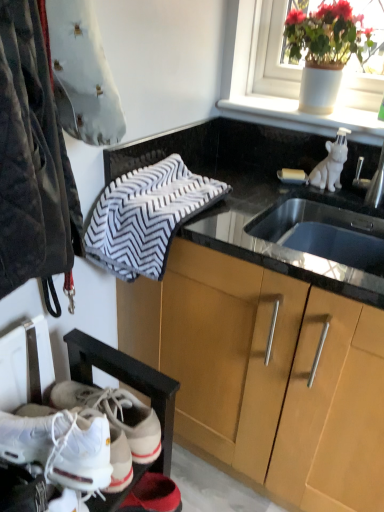
You are a GUI agent. You are given a task and a screenshot of the screen. Output one action in this format:
    pyautogui.click(x=<x>, y=<y>)
    Task: Click on the white glossy ceramic dog at upper right, the 2th animal from the front
    The width and height of the screenshot is (384, 512).
    Given the screenshot: What is the action you would take?
    pyautogui.click(x=331, y=163)

In the scene shown: What is the approximate width of white leather sneakers at lower left?

white leather sneakers at lower left is 30.67 centimeters wide.

Locate an element on the screen. The height and width of the screenshot is (512, 384). wooden cabinet at center is located at coordinates (266, 374).

What do you see at coordinates (266, 374) in the screenshot?
I see `wooden cabinet at center` at bounding box center [266, 374].

Describe the element at coordinates (324, 50) in the screenshot. I see `white ceramic pot at upper right` at that location.

You are a GUI agent. You are given a task and a screenshot of the screen. Output one action in this format:
    pyautogui.click(x=<x>, y=<y>)
    Task: Click on the white glossy ceramic dog at upper right, the 2th animal from the front
    The image size is (384, 512).
    Given the screenshot: What is the action you would take?
    pyautogui.click(x=331, y=163)

Can we say white leather sneakers at lower left lies outside wooden cabinet at center?

Absolutely, white leather sneakers at lower left is external to wooden cabinet at center.

Considering the relative sizes of white leather sneakers at lower left and wooden cabinet at center in the image provided, is white leather sneakers at lower left wider than wooden cabinet at center?

In fact, white leather sneakers at lower left might be narrower than wooden cabinet at center.

Based on their positions, is white leather sneakers at lower left located to the left or right of wooden cabinet at center?

From the image, it's evident that white leather sneakers at lower left is to the left of wooden cabinet at center.

From a real-world perspective, is white leather sneakers at lower left physically located above or below white glossy ceramic dog at upper right, the 2th animal from the front?

Clearly, from a real-world perspective, white leather sneakers at lower left is below white glossy ceramic dog at upper right, the 2th animal from the front.

Is white leather sneakers at lower left thinner than white glossy ceramic dog at upper right, the first animal positioned from the back?

Incorrect, the width of white leather sneakers at lower left is not less than that of white glossy ceramic dog at upper right, the first animal positioned from the back.

Can you tell me how much white leather sneakers at lower left and white glossy ceramic dog at upper right, the 1th animal viewed from the right, differ in facing direction?

92.1 degrees separate the facing orientations of white leather sneakers at lower left and white glossy ceramic dog at upper right, the 1th animal viewed from the right.

In terms of height, does wooden cabinet at center look taller or shorter compared to white glossy ceramic dog at upper right, the 1th animal viewed from the right?

Clearly, wooden cabinet at center is taller compared to white glossy ceramic dog at upper right, the 1th animal viewed from the right.

From the image's perspective, would you say wooden cabinet at center is shown under white glossy ceramic dog at upper right, the 1th animal viewed from the right?

Correct, wooden cabinet at center appears lower than white glossy ceramic dog at upper right, the 1th animal viewed from the right, in the image.

Is wooden cabinet at center positioned in front of white glossy ceramic dog at upper right, the 1th animal viewed from the right?

Yes, wooden cabinet at center is in front of white glossy ceramic dog at upper right, the 1th animal viewed from the right.

Based on their positions, is wooden cabinet at center located to the left or right of white glossy ceramic dog at upper right, the 1th animal viewed from the right?

Clearly, wooden cabinet at center is on the left of white glossy ceramic dog at upper right, the 1th animal viewed from the right, in the image.

From the image's perspective, is velvet-like gray pillow at upper left, which is counted as the second animal, starting from the right, located beneath white leather sneakers at lower left?

Incorrect, from the image's perspective, velvet-like gray pillow at upper left, which is counted as the second animal, starting from the right, is higher than white leather sneakers at lower left.

Which of these two, velvet-like gray pillow at upper left, arranged as the 2th animal when viewed from the back, or white leather sneakers at lower left, is wider?

Wider between the two is white leather sneakers at lower left.

From a real-world perspective, which object stands above the other?

velvet-like gray pillow at upper left, which is counted as the second animal, starting from the right, from a real-world perspective.

Is velvet-like gray pillow at upper left, the first animal in the front-to-back sequence, facing towards white leather sneakers at lower left?

No, velvet-like gray pillow at upper left, the first animal in the front-to-back sequence, is not turned towards white leather sneakers at lower left.

How different are the orientations of wooden cabinet at center and velvet-like gray pillow at upper left, the 1th animal viewed from the left, in degrees?

91.5 degrees.

Considering the relative sizes of wooden cabinet at center and velvet-like gray pillow at upper left, the first animal in the front-to-back sequence, in the image provided, is wooden cabinet at center wider than velvet-like gray pillow at upper left, the first animal in the front-to-back sequence,?

Yes.

Considering the sizes of objects wooden cabinet at center and velvet-like gray pillow at upper left, arranged as the 2th animal when viewed from the back, in the image provided, who is smaller, wooden cabinet at center or velvet-like gray pillow at upper left, arranged as the 2th animal when viewed from the back,?

velvet-like gray pillow at upper left, arranged as the 2th animal when viewed from the back, is smaller.

Is wooden cabinet at center looking in the opposite direction of velvet-like gray pillow at upper left, the first animal in the front-to-back sequence?

wooden cabinet at center does not have its back to velvet-like gray pillow at upper left, the first animal in the front-to-back sequence.

Is point (285, 419) more distant than point (312, 89)?

No, (285, 419) is in front of (312, 89).

Is wooden cabinet at center to the left or to the right of white ceramic pot at upper right in the image?

→ Clearly, wooden cabinet at center is on the left of white ceramic pot at upper right in the image.

Does wooden cabinet at center have a smaller size compared to white ceramic pot at upper right?

Actually, wooden cabinet at center might be larger than white ceramic pot at upper right.

Can we say wooden cabinet at center lies outside white ceramic pot at upper right?

Yes, wooden cabinet at center is outside of white ceramic pot at upper right.

Is white leather sneakers at lower left facing towards gray textured towel at upper center?

No, white leather sneakers at lower left does not turn towards gray textured towel at upper center.

Which is nearer, (68, 428) or (163, 219)?

The point (68, 428) is more forward.

Considering the positions of objects white leather sneakers at lower left and gray textured towel at upper center in the image provided, who is more to the right, white leather sneakers at lower left or gray textured towel at upper center?

gray textured towel at upper center is more to the right.

Considering the relative sizes of white leather sneakers at lower left and gray textured towel at upper center in the image provided, is white leather sneakers at lower left smaller than gray textured towel at upper center?

Yes, white leather sneakers at lower left is smaller than gray textured towel at upper center.

You are a GUI agent. You are given a task and a screenshot of the screen. Output one action in this format:
    pyautogui.click(x=<x>, y=<y>)
    Task: Click on the footwear that appears below the wooden cabinet at center (from the image's perspective)
    Image resolution: width=384 pixels, height=512 pixels.
    Given the screenshot: What is the action you would take?
    pyautogui.click(x=60, y=448)

At what (x,y) coordinates should I click in order to perform the action: click on footwear located underneath the white glossy ceramic dog at upper right, the 2th animal from the front (from a real-world perspective). Please return your answer as a coordinate pair (x, y). Looking at the image, I should click on (60, 448).

Looking at the image, which one is located closer to gray textured towel at upper center, white leather sneakers at lower left or white glossy ceramic dog at upper right, which is counted as the 2th animal, starting from the left?

white leather sneakers at lower left.

Considering their positions, is gray textured towel at upper center positioned further to white ceramic pot at upper right than white glossy ceramic dog at upper right, which is counted as the 2th animal, starting from the left?

gray textured towel at upper center lies further to white ceramic pot at upper right than the other object.

Which object lies nearer to the anchor point wooden cabinet at center, white leather sneakers at lower left or white glossy ceramic dog at upper right, the first animal positioned from the back?

white leather sneakers at lower left lies closer to wooden cabinet at center than the other object.

Looking at the image, which one is located closer to velvet-like gray pillow at upper left, the first animal in the front-to-back sequence, gray textured towel at upper center or white ceramic pot at upper right?

gray textured towel at upper center lies closer to velvet-like gray pillow at upper left, the first animal in the front-to-back sequence, than the other object.

Considering their positions, is gray textured towel at upper center positioned further to velvet-like gray pillow at upper left, arranged as the 2th animal when viewed from the back, than white leather sneakers at lower left?

Among the two, white leather sneakers at lower left is located further to velvet-like gray pillow at upper left, arranged as the 2th animal when viewed from the back.

When comparing their distances from white glossy ceramic dog at upper right, the 2th animal from the front, does velvet-like gray pillow at upper left, which is counted as the second animal, starting from the right, or gray textured towel at upper center seem further?

velvet-like gray pillow at upper left, which is counted as the second animal, starting from the right, is positioned further to the anchor white glossy ceramic dog at upper right, the 2th animal from the front.

When comparing their distances from gray textured towel at upper center, does velvet-like gray pillow at upper left, arranged as the 2th animal when viewed from the back, or white ceramic pot at upper right seem closer?

The object closer to gray textured towel at upper center is velvet-like gray pillow at upper left, arranged as the 2th animal when viewed from the back.

When comparing their distances from white leather sneakers at lower left, does gray textured towel at upper center or velvet-like gray pillow at upper left, arranged as the 2th animal when viewed from the back, seem further?

The object further to white leather sneakers at lower left is velvet-like gray pillow at upper left, arranged as the 2th animal when viewed from the back.

Locate an element on the screen. animal that lies between velvet-like gray pillow at upper left, the 1th animal viewed from the left, and white leather sneakers at lower left from top to bottom is located at coordinates (331, 163).

Where is `hand towel between velvet-like gray pillow at upper left, the first animal in the front-to-back sequence, and white leather sneakers at lower left in the up-down direction`? This screenshot has width=384, height=512. hand towel between velvet-like gray pillow at upper left, the first animal in the front-to-back sequence, and white leather sneakers at lower left in the up-down direction is located at coordinates click(146, 216).

This screenshot has width=384, height=512. I want to click on cabinetry between velvet-like gray pillow at upper left, which is counted as the second animal, starting from the right, and white leather sneakers at lower left, in the vertical direction, so coord(266,374).

Where is `cabinetry between white ceramic pot at upper right and white leather sneakers at lower left from top to bottom`? The height and width of the screenshot is (512, 384). cabinetry between white ceramic pot at upper right and white leather sneakers at lower left from top to bottom is located at coordinates (266, 374).